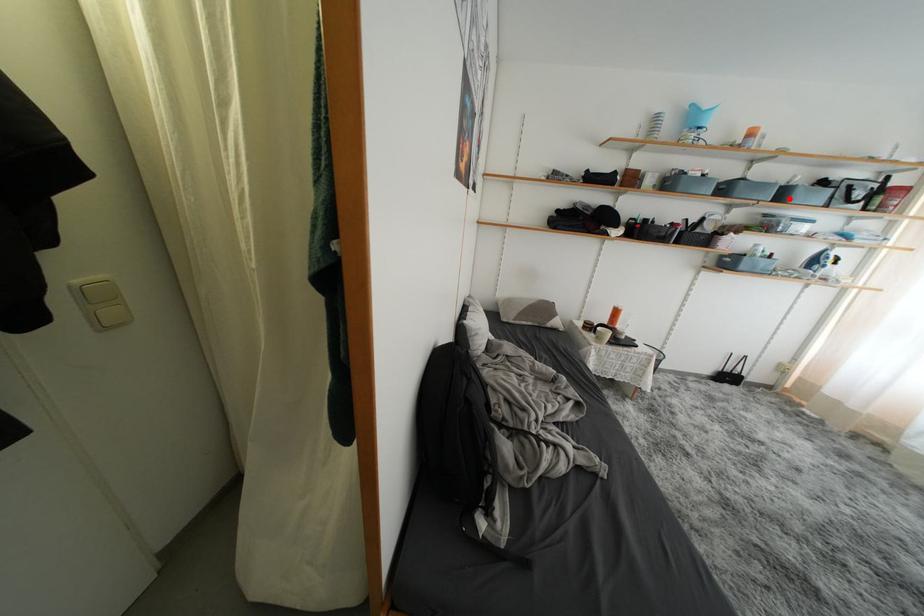
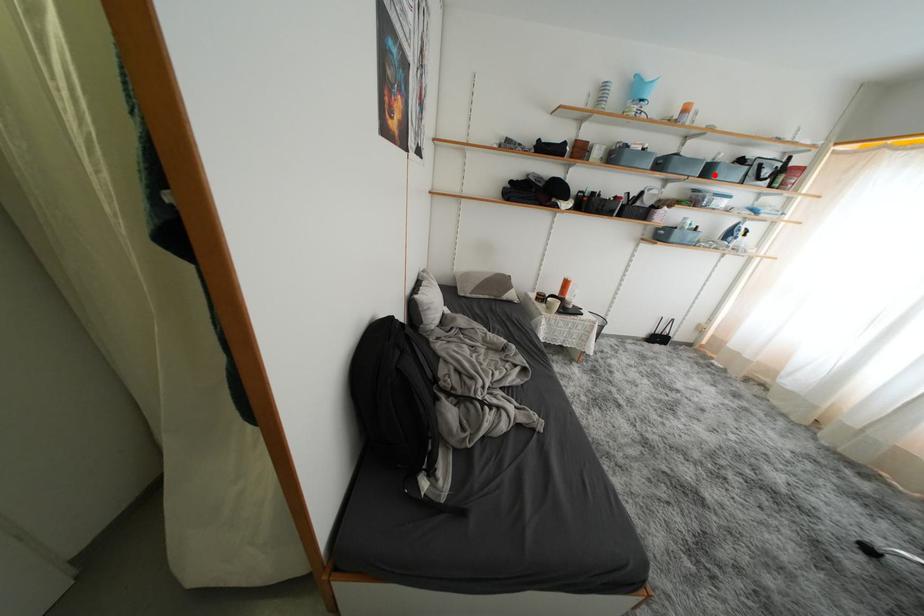
I am providing you with two images of the same scene from different viewpoints. A red point is marked on the first image and another point is marked on the second image. Are the points marked in image1 and image2 representing the same 3D position?

Yes